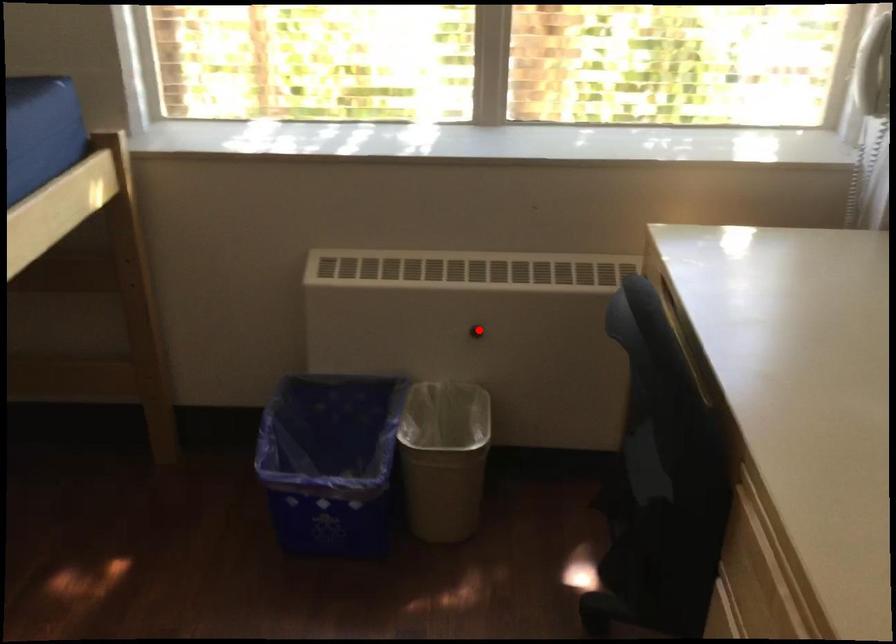
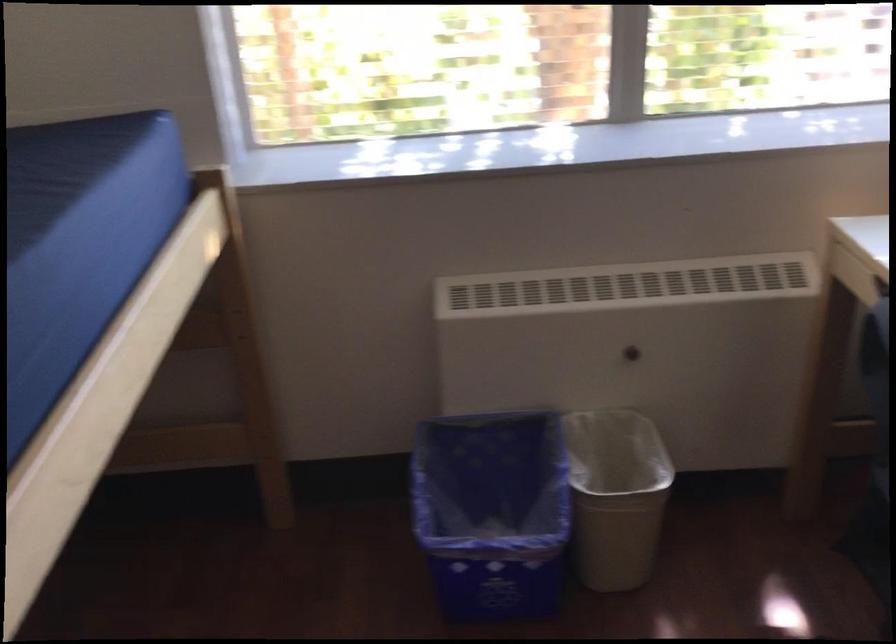
Locate, in the second image, the point that corresponds to the highlighted location in the first image.

(634, 351)